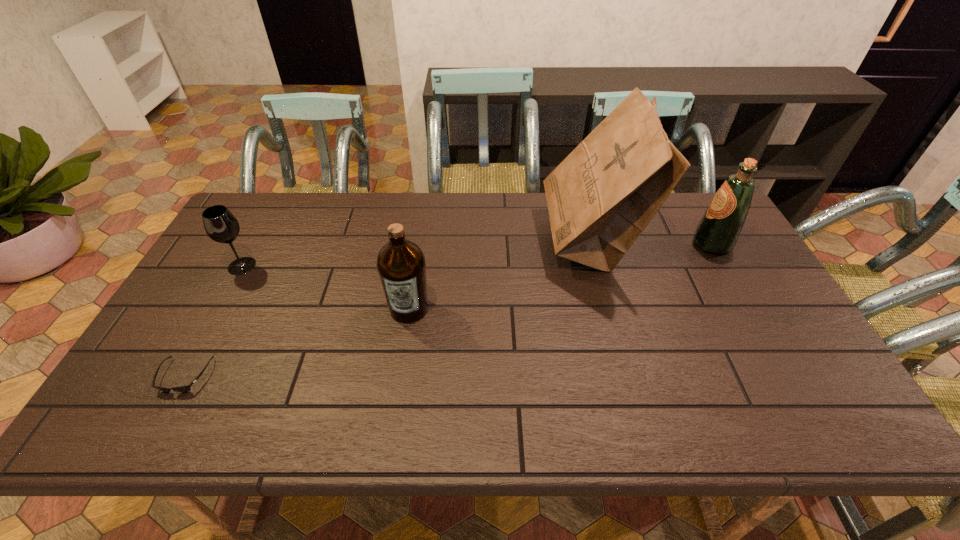
This screenshot has width=960, height=540. Identify the location of free region located 0.400m on the front-facing side of the rightmost object. (565, 244).

Find the location of a particular element. The image size is (960, 540). vacant region located on the front-facing side of the rightmost object is located at coordinates (632, 244).

Locate an element on the screen. The image size is (960, 540). vacant space located 0.250m on the front-facing side of the rightmost object is located at coordinates (612, 244).

Where is `free point located 0.210m on the label of the third object from left to right`? The height and width of the screenshot is (540, 960). free point located 0.210m on the label of the third object from left to right is located at coordinates (396, 398).

You are a GUI agent. You are given a task and a screenshot of the screen. Output one action in this format:
    pyautogui.click(x=<x>, y=<y>)
    Task: Click on the vacant space located on the right of the wineglass
    The width and height of the screenshot is (960, 540).
    Given the screenshot: What is the action you would take?
    pyautogui.click(x=329, y=266)

The width and height of the screenshot is (960, 540). Find the location of `grocery bag at the far edge`. grocery bag at the far edge is located at coordinates (601, 197).

I want to click on olive oil present at the far edge, so click(x=718, y=230).

The image size is (960, 540). What are the coordinates of `wineglass that is at the left edge` in the screenshot? It's located at 220,224.

I want to click on sunglasses present at the left edge, so click(x=182, y=388).

This screenshot has height=540, width=960. Identify the location of object that is positioned at the right edge. (718, 230).